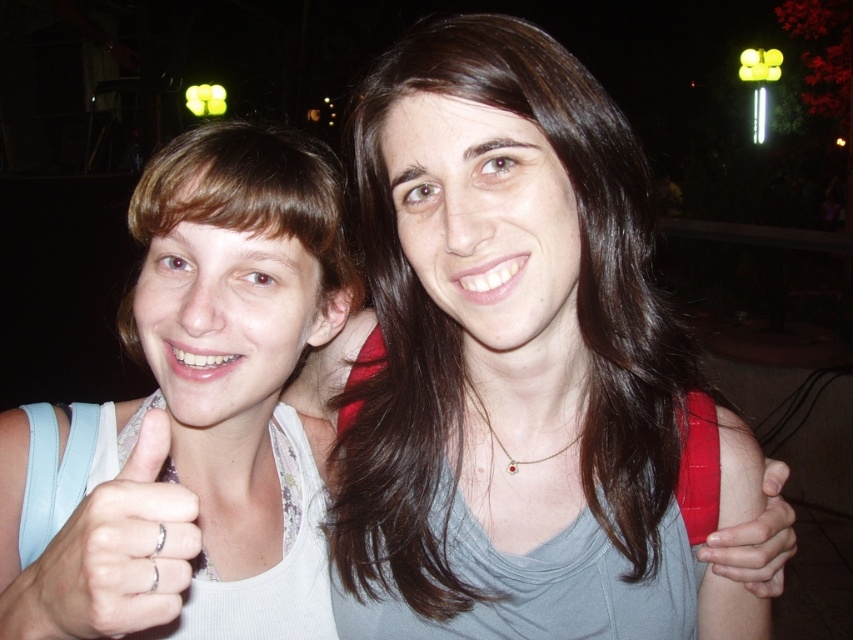
Question: Does dark brown hair at center come in front of silver metallic ring at lower left?

Choices:
 (A) no
 (B) yes

Answer: (A)

Question: Which point is closer to the camera?

Choices:
 (A) silver metallic ring at lower left
 (B) smooth skin hand at center

Answer: (A)

Question: Is dark brown hair at center to the right of silver metallic ring at lower left from the viewer's perspective?

Choices:
 (A) no
 (B) yes

Answer: (B)

Question: Which object is the closest to the white fabric shirt at left?

Choices:
 (A) smooth skin hand at center
 (B) silver metallic ring at lower left
 (C) dark brown hair at center

Answer: (B)

Question: Which of the following is the farthest from the observer?

Choices:
 (A) (381, 456)
 (B) (750, 588)
 (C) (254, 451)

Answer: (C)

Question: Can you confirm if dark brown hair at center is smaller than silver metallic ring at lower left?

Choices:
 (A) no
 (B) yes

Answer: (A)